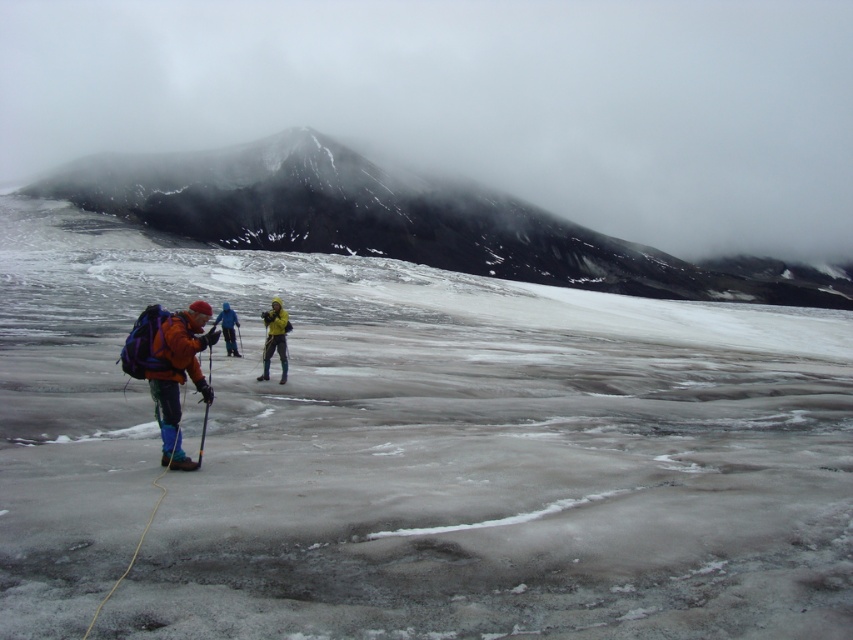
Find the location of `snowy rocky mountain at upper center`. snowy rocky mountain at upper center is located at coordinates (405, 221).

Is snowy rocky mountain at upper center above orange fleece jacket at left?

Yes, snowy rocky mountain at upper center is above orange fleece jacket at left.

Identify the location of snowy rocky mountain at upper center. (x=405, y=221).

Between point (160, 381) and point (231, 321), which one is positioned behind?

Point (231, 321)

Is orange fleece jacket at left above orange fleece jacket at center?

No, orange fleece jacket at left is not above orange fleece jacket at center.

Between point (177, 333) and point (231, 328), which one is positioned behind?

Positioned behind is point (231, 328).

The image size is (853, 640). Identify the location of orange fleece jacket at left. (178, 374).

Does yellow fabric jacket at center have a lesser height compared to orange fleece jacket at center?

No, yellow fabric jacket at center is not shorter than orange fleece jacket at center.

Is yellow fabric jacket at center wider than orange fleece jacket at center?

Incorrect, yellow fabric jacket at center's width does not surpass orange fleece jacket at center's.

This screenshot has width=853, height=640. Describe the element at coordinates (276, 339) in the screenshot. I see `yellow fabric jacket at center` at that location.

Where is `yellow fabric jacket at center`? The image size is (853, 640). yellow fabric jacket at center is located at coordinates (276, 339).